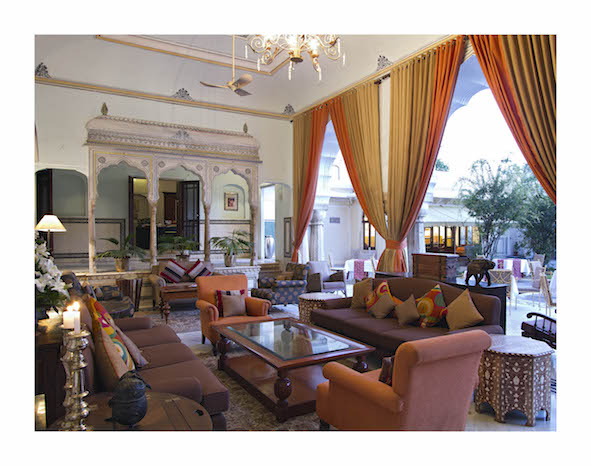
Find the location of `ceiling fan`. ceiling fan is located at coordinates (233, 87).